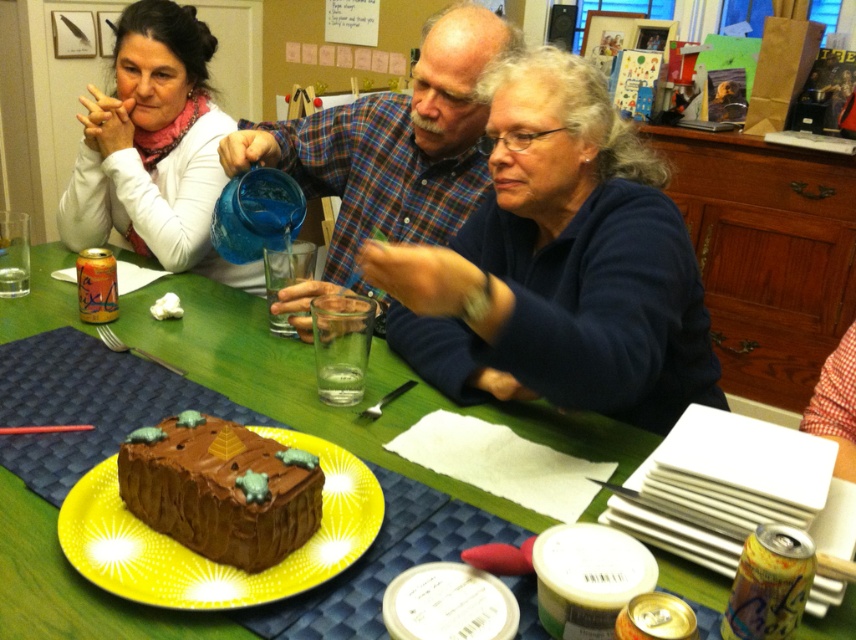
You are a guest at the gathering and want to reach for the yellow glossy plate at center. However, there is a matte white sweater at upper left in your way. Can you easily access the plate without moving the sweater?

The matte white sweater at upper left is further to the viewer than the yellow glossy plate at center, meaning the sweater is closer to you. Since the sweater is in front of the plate, you would need to move it to access the plate easily.

You are a guest at the table and want to reach for the yellow glossy plate at center without touching the blue plaid shirt at center. Is this possible?

The blue plaid shirt at center is located above the yellow glossy plate at center, so you can reach for the yellow glossy plate at center carefully without touching the blue plaid shirt at center by moving under it.

You are a guest at the gathering and want to reach for the chocolate cake at lower left and the yellow glossy plate at center. Which item is closer to you?

The chocolate cake at lower left is closer to you because it is further to the viewer than the yellow glossy plate at center.